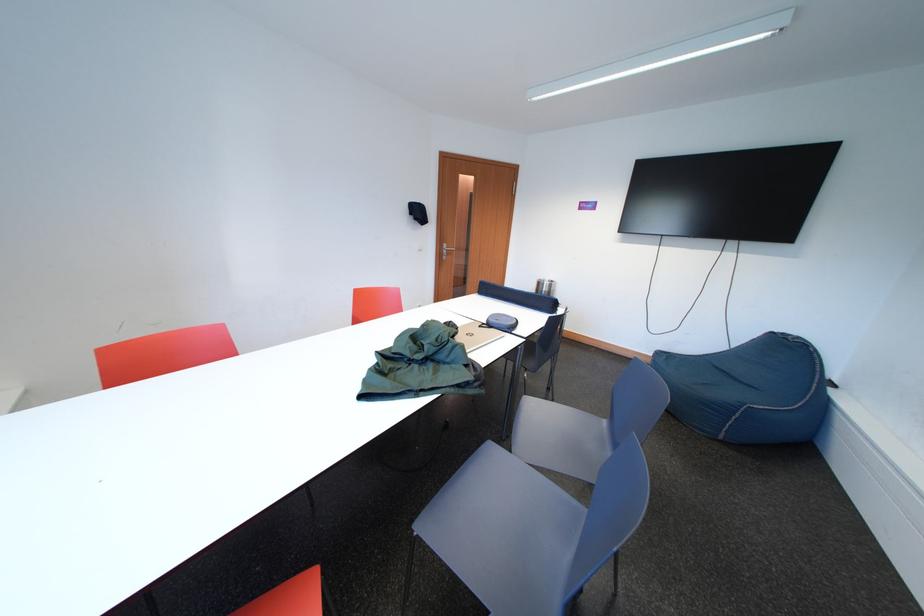
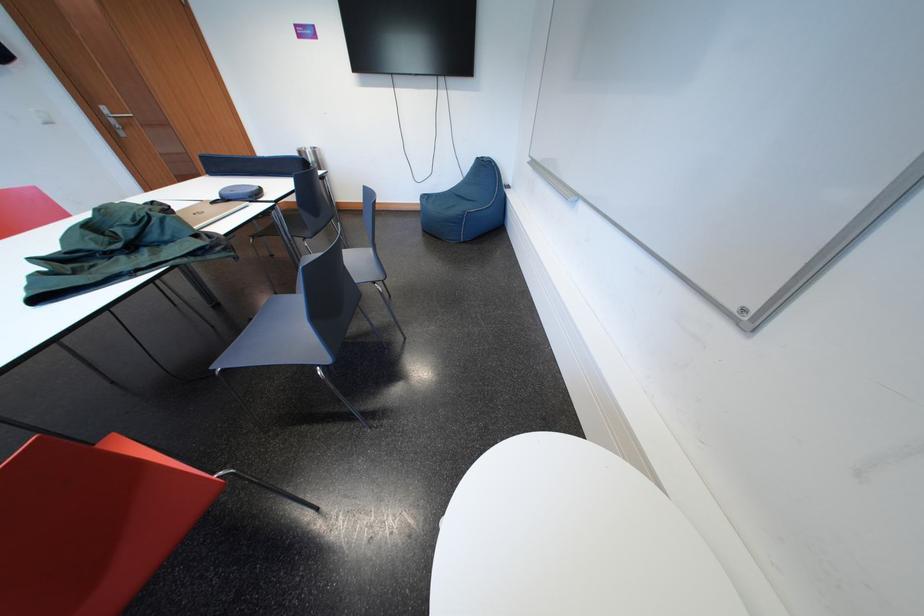
The point at (499, 330) is marked in the first image. Where is the corresponding point in the second image?

(235, 204)